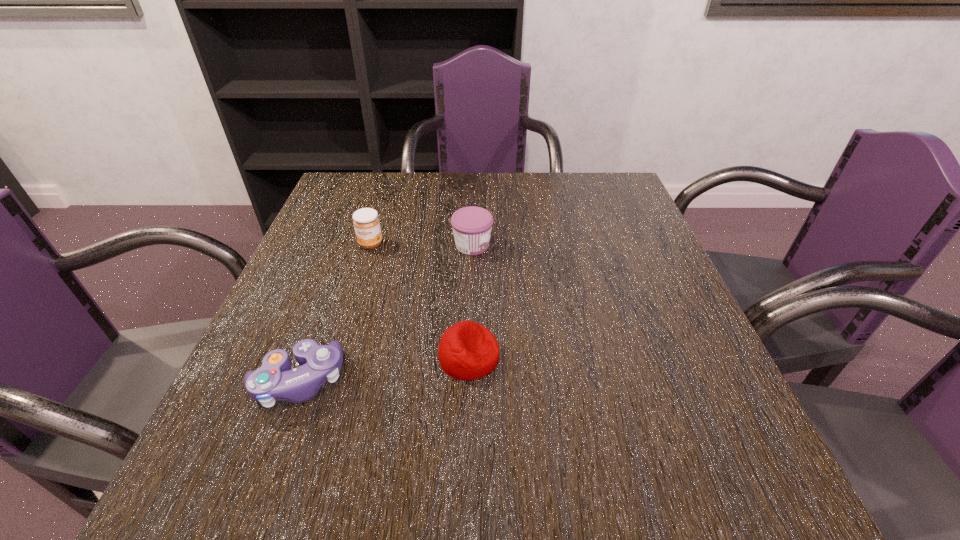
This screenshot has height=540, width=960. I want to click on vacant region at the far edge of the desktop, so click(x=439, y=174).

In the image, there is a desktop. At what (x,y) coordinates should I click in order to perform the action: click on vacant space at the near edge. Please return your answer as a coordinate pair (x, y). The height and width of the screenshot is (540, 960). Looking at the image, I should click on (610, 500).

Identify the location of vacant point at the left edge. Image resolution: width=960 pixels, height=540 pixels. (281, 344).

At what (x,y) coordinates should I click in order to perform the action: click on vacant region at the right edge of the desktop. Please return your answer as a coordinate pair (x, y). The width and height of the screenshot is (960, 540). Looking at the image, I should click on (674, 314).

The width and height of the screenshot is (960, 540). Identify the location of free region at the far left corner of the desktop. (383, 184).

In order to click on free space at the near right corner of the desktop in this screenshot , I will do `click(769, 516)`.

Image resolution: width=960 pixels, height=540 pixels. What are the coordinates of `vacant area that lies between the left jam and the beanbag` in the screenshot? It's located at (420, 300).

Find the location of a particular element. This screenshot has width=960, height=540. free space between the right jam and the beanbag is located at coordinates (470, 301).

Where is `vacant area that lies between the beanbag and the control`? vacant area that lies between the beanbag and the control is located at coordinates (384, 369).

The image size is (960, 540). What are the coordinates of `blank region between the right jam and the shortest object` in the screenshot? It's located at (470, 301).